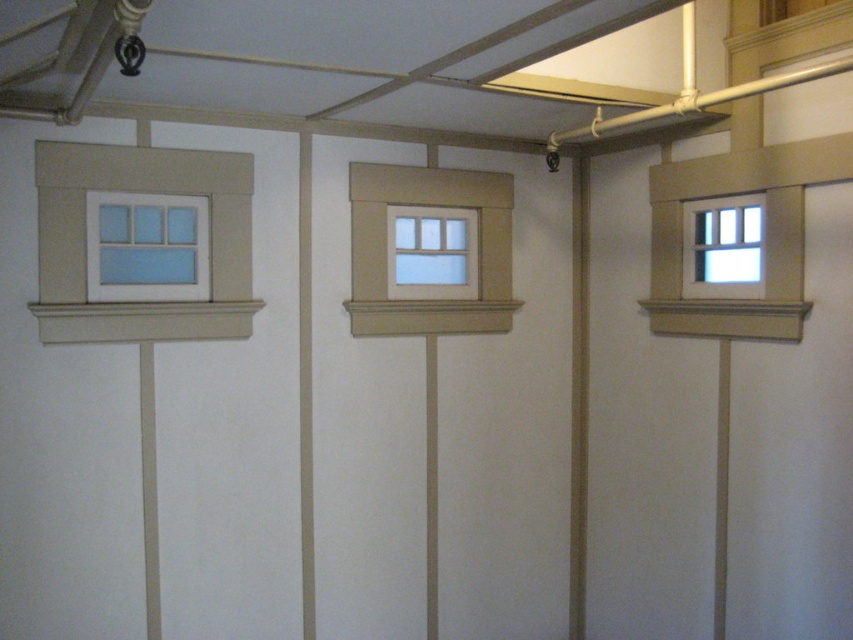
You are standing in a room and want to clean the white painted wood window at upper left. If your ladder can reach up to 10 feet, will you be able to reach the window?

The white painted wood window at upper left is 9.90 feet away from the camera, so yes, the ladder can reach it since it is within the 10 feet limit.

You are standing in a room with three windows. You see the white painted wood window at upper left and the white painted wood window at right. Which one is positioned lower on the wall?

The white painted wood window at upper left is positioned lower on the wall than the white painted wood window at right.

You are an interior designer assessing the wall with two windows. The matte white wood window at center and the white painted wood window at center are both in the same location. Which one is taller?

The matte white wood window at center is much taller than the white painted wood window at center.